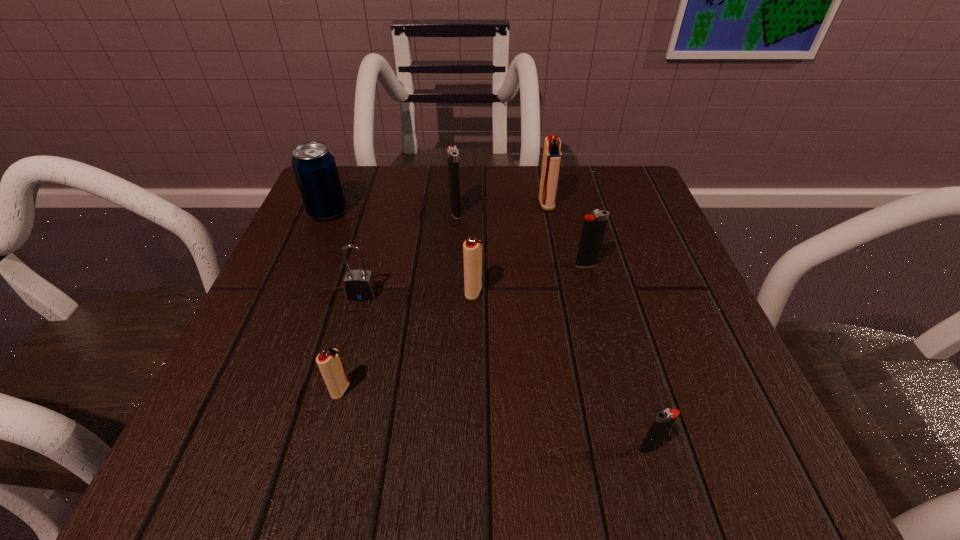
Where is `the leftmost igniter`? The image size is (960, 540). the leftmost igniter is located at coordinates (329, 362).

The width and height of the screenshot is (960, 540). In order to click on the nearest red igniter in this screenshot , I will do `click(329, 362)`.

Find the location of a particular element. The image size is (960, 540). the nearest object is located at coordinates (664, 420).

This screenshot has width=960, height=540. In order to click on the smallest black igniter in this screenshot , I will do `click(664, 420)`.

Where is `blank space located on the left of the farthest red igniter`? Image resolution: width=960 pixels, height=540 pixels. blank space located on the left of the farthest red igniter is located at coordinates (422, 204).

Where is `vacant region located on the right of the fifth object from right to left`? vacant region located on the right of the fifth object from right to left is located at coordinates (542, 212).

You are a GUI agent. You are given a task and a screenshot of the screen. Output one action in this format:
    pyautogui.click(x=<x>, y=<y>)
    Task: Click on the vacant space positioned on the right of the leftmost object
    This screenshot has height=540, width=960.
    Given the screenshot: What is the action you would take?
    pyautogui.click(x=480, y=212)

Locate an element on the screen. The width and height of the screenshot is (960, 540). vacant point located on the left of the fifth nearest object is located at coordinates (449, 265).

I want to click on free space located on the left of the second farthest red igniter, so click(325, 292).

Where is `free space located 0.250m on the shackle of the gray padlock`? The height and width of the screenshot is (540, 960). free space located 0.250m on the shackle of the gray padlock is located at coordinates click(323, 444).